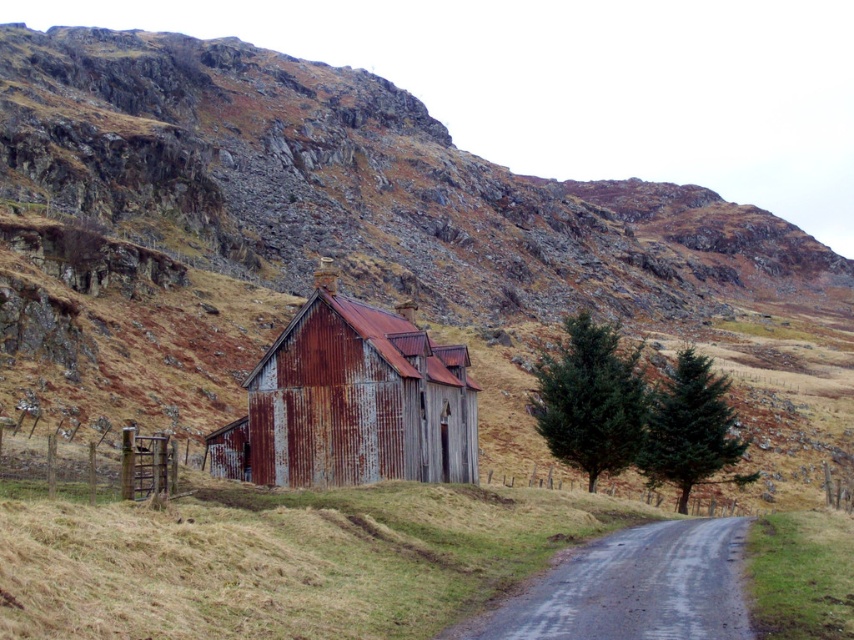
Question: Estimate the real-world distances between objects in this image. Which object is farther from the green textured tree at right?

Choices:
 (A) green matte tree at right
 (B) rusty corrugated metal barn at center

Answer: (B)

Question: Considering the real-world distances, which object is closest to the green matte tree at right?

Choices:
 (A) green textured tree at right
 (B) rusty corrugated metal barn at center

Answer: (A)

Question: Observing the image, what is the correct spatial positioning of rusty corrugated metal barn at center in reference to green matte tree at right?

Choices:
 (A) below
 (B) above

Answer: (A)

Question: Is rusty corrugated metal barn at center thinner than green matte tree at right?

Choices:
 (A) no
 (B) yes

Answer: (B)

Question: Which of the following is the farthest from the observer?

Choices:
 (A) (635, 412)
 (B) (755, 472)

Answer: (B)

Question: Does rusty corrugated metal barn at center have a lesser width compared to green textured tree at right?

Choices:
 (A) no
 (B) yes

Answer: (B)